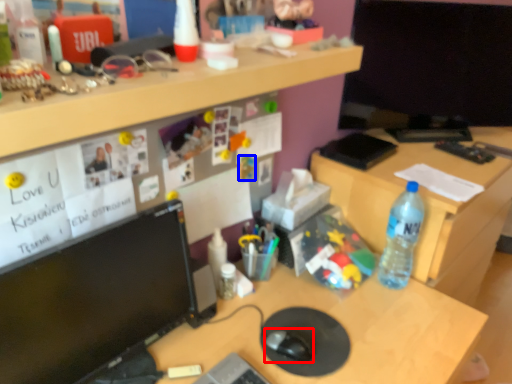
Question: Which of the following is the closest to the observer, mouse (highlighted by a red box) or toy (highlighted by a blue box)?

Choices:
 (A) mouse
 (B) toy

Answer: (A)